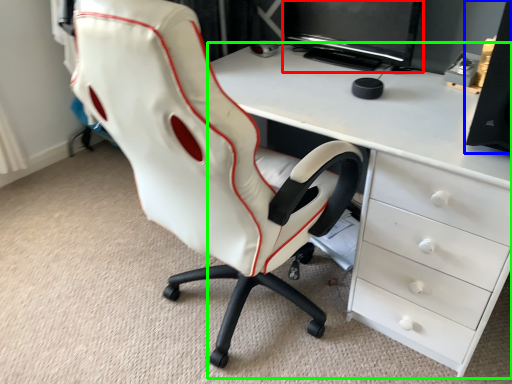
Question: Which object is positioned farthest from computer monitor (highlighted by a red box)? Select from speaker (highlighted by a blue box) and desk (highlighted by a green box).

Choices:
 (A) speaker
 (B) desk

Answer: (A)